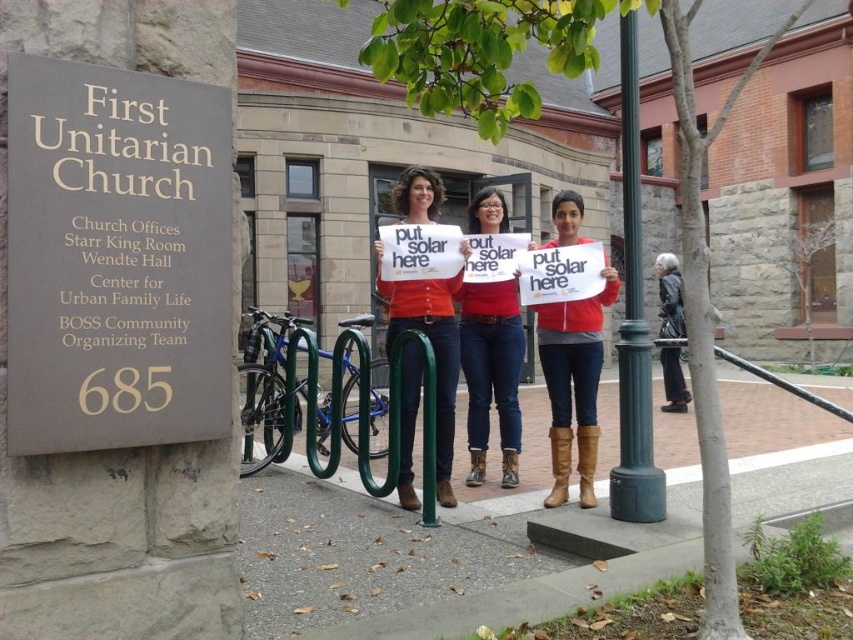
Based on the scene at the First Unitarian Church, if you were standing where the protesters are, which object would you encounter first when moving towards the green painted metal pole at right and the matte red shirt at center?

The green painted metal pole at right is closer to the viewer than the matte red shirt at center, so you would encounter the green painted metal pole at right first.

You are standing in front of the First Unitarian Church at 685. You see two points marked on the ground. The first point is at coordinate point (38, 420) and the second is at point (624, 406). Which point is closer to you?

Point (38, 420) is closer to the viewer than point (624, 406).

You are a photographer trying to capture a photo of the matte orange shirt at center and the green painted metal pole at right. Which object should you focus on first if you want to ensure both are in sharp focus, considering their heights?

The green painted metal pole at right has a lesser height compared to matte orange shirt at center, so you should focus on the matte orange shirt at center first to ensure both are in sharp focus.